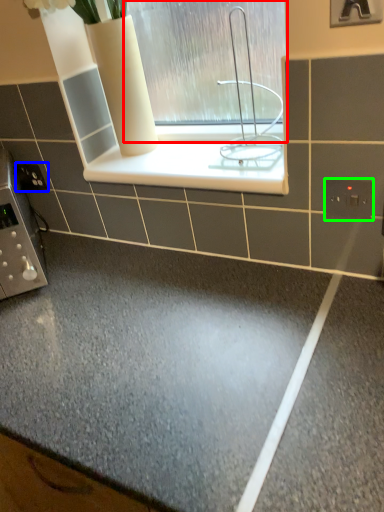
Question: Considering the real-world distances, which object is farthest from window (highlighted by a red box)? electric outlet (highlighted by a blue box) or electric outlet (highlighted by a green box)?

Choices:
 (A) electric outlet
 (B) electric outlet

Answer: (A)